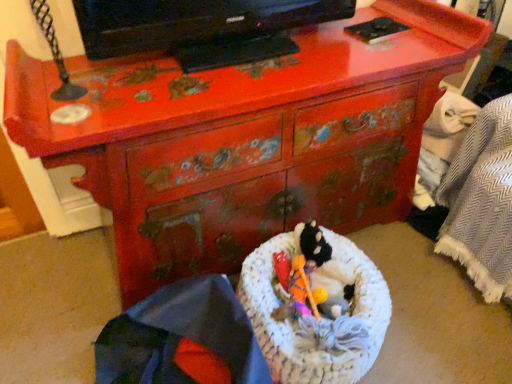
Question: In terms of height, does woven fabric basket at lower center look taller or shorter compared to white knitted laundry basket at center?

Choices:
 (A) short
 (B) tall

Answer: (B)

Question: Visually, is woven fabric basket at lower center positioned to the left or to the right of white knitted laundry basket at center?

Choices:
 (A) left
 (B) right

Answer: (A)

Question: Which of these objects is positioned closest to the white knitted laundry basket at center?

Choices:
 (A) black glossy tv at upper center
 (B) woven fabric basket at lower center

Answer: (B)

Question: Estimate the real-world distances between objects in this image. Which object is farther from the black glossy tv at upper center?

Choices:
 (A) white knitted laundry basket at center
 (B) woven fabric basket at lower center

Answer: (B)